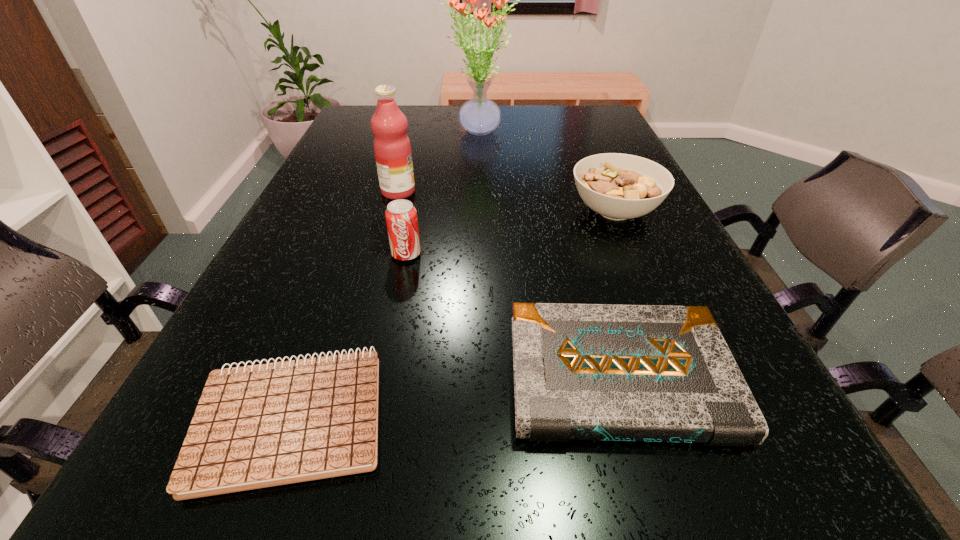
The image size is (960, 540). Find the location of `free space located on the back of the flower arrangement`. free space located on the back of the flower arrangement is located at coordinates (479, 110).

The height and width of the screenshot is (540, 960). Find the location of `free space located 0.160m on the label of the fifth shortest object`. free space located 0.160m on the label of the fifth shortest object is located at coordinates (484, 192).

You are a GUI agent. You are given a task and a screenshot of the screen. Output one action in this format:
    pyautogui.click(x=<x>, y=<y>)
    Task: Click on the vacant space situated on the logo side of the third nearest object
    The height and width of the screenshot is (540, 960).
    Given the screenshot: What is the action you would take?
    pyautogui.click(x=369, y=440)

Image resolution: width=960 pixels, height=540 pixels. Identify the location of blank space located on the front of the stew. (641, 273).

The height and width of the screenshot is (540, 960). In order to click on free space located on the back of the taller notebook in this screenshot , I will do `click(593, 288)`.

At what (x,y) coordinates should I click in order to perform the action: click on vacant space located 0.210m on the right of the left notebook. Please return your answer as a coordinate pair (x, y). This screenshot has width=960, height=540. Looking at the image, I should click on (543, 417).

This screenshot has width=960, height=540. I want to click on object that is at the far edge, so pyautogui.click(x=479, y=116).

In order to click on object located in the near edge section of the desktop in this screenshot , I will do `click(256, 426)`.

Identify the location of object at the left edge. The height and width of the screenshot is (540, 960). (256, 426).

The height and width of the screenshot is (540, 960). What are the coordinates of `stew at the right edge` in the screenshot? It's located at (618, 186).